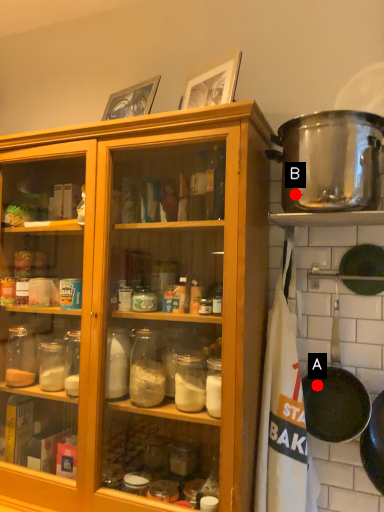
Question: Two points are circled on the image, labeled by A and B beside each circle. Which point is farther to the camera?

Choices:
 (A) A is further
 (B) B is further

Answer: (A)